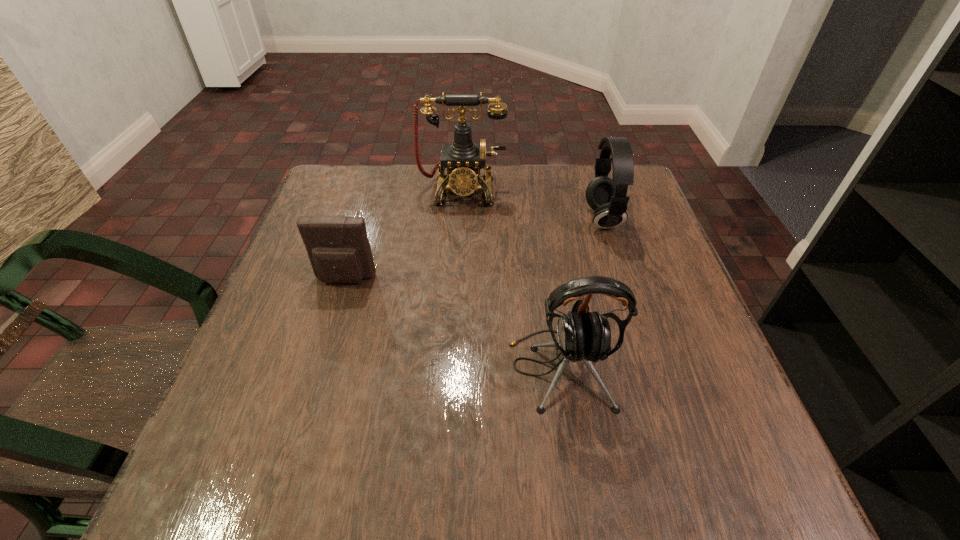
At what (x,y) coordinates should I click in order to perform the action: click on telephone. Please return your answer as a coordinate pair (x, y). Image resolution: width=960 pixels, height=540 pixels. Looking at the image, I should click on (463, 159).

Identify the location of the taller earphone. (582, 336).

The image size is (960, 540). Identify the location of the left earphone. (582, 336).

Identify the location of the farther earphone. (606, 196).

This screenshot has height=540, width=960. I want to click on the rightmost object, so click(606, 196).

Identify the location of pouch. (338, 247).

Where is `the leftmost object`? the leftmost object is located at coordinates (338, 247).

Locate an element on the screen. Image resolution: width=960 pixels, height=540 pixels. free spot located on the front of the telephone, featuring the rotary dial is located at coordinates (458, 271).

Identify the location of vacant space located on the right of the left earphone. The width and height of the screenshot is (960, 540). (708, 369).

Identify the location of vacant position located 0.340m on the ear cups of the right earphone. This screenshot has height=540, width=960. (445, 219).